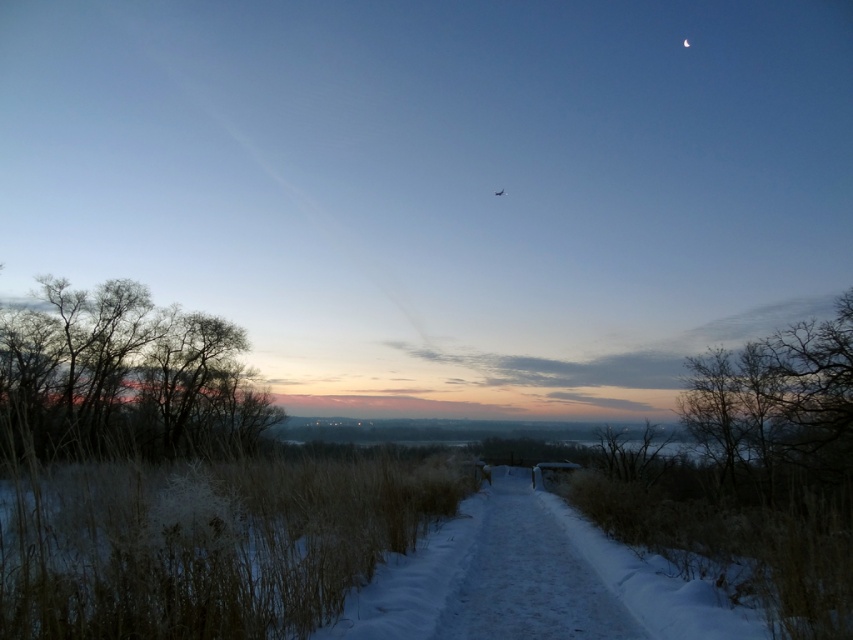
You are standing at the starting point of the snow path and want to reach the shelter. There are two points marked on the path. Which point is closer to you, point (106, 422) or point (485, 524)?

Point (106, 422) is closer to you because it is further to the camera than point (485, 524).

You are an explorer in a winter landscape. You see the bare branches at left and the white snow trail at center. Which object is taller?

The bare branches at left are much taller than the white snow trail at center.

From the picture: You are an explorer trying to follow the white snow trail at center in the winter landscape. There are bare branches at left nearby. Which direction should you walk to stay on the trail and avoid the branches?

The bare branches at left are wider than the white snow trail at center, so you should walk towards the center to stay on the trail and avoid the branches on the left.